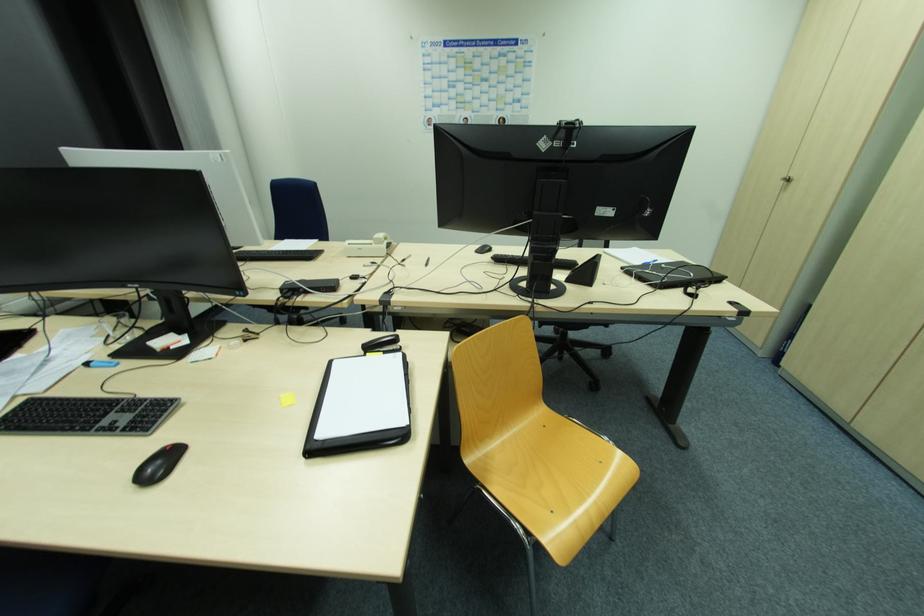
Where is `white phone handset`? white phone handset is located at coordinates (369, 246).